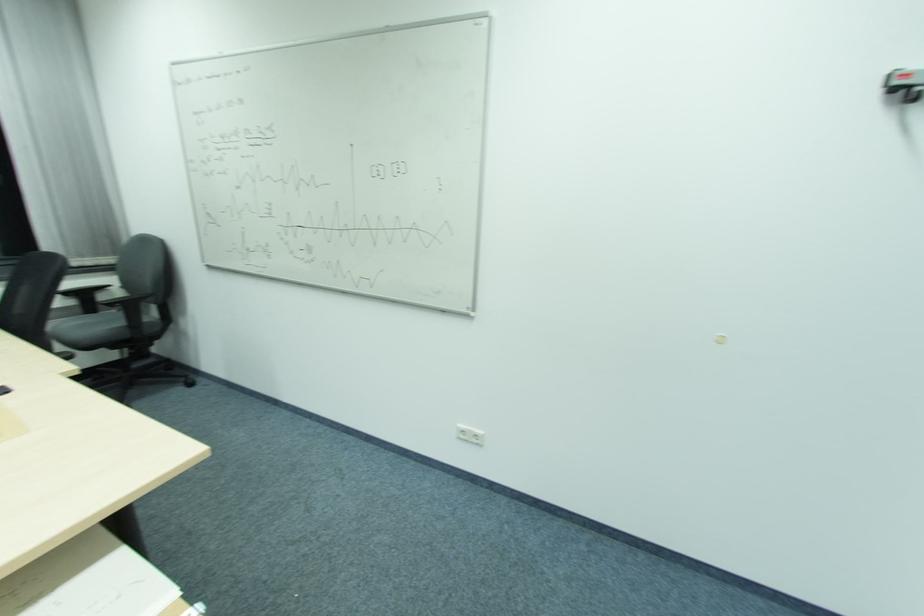
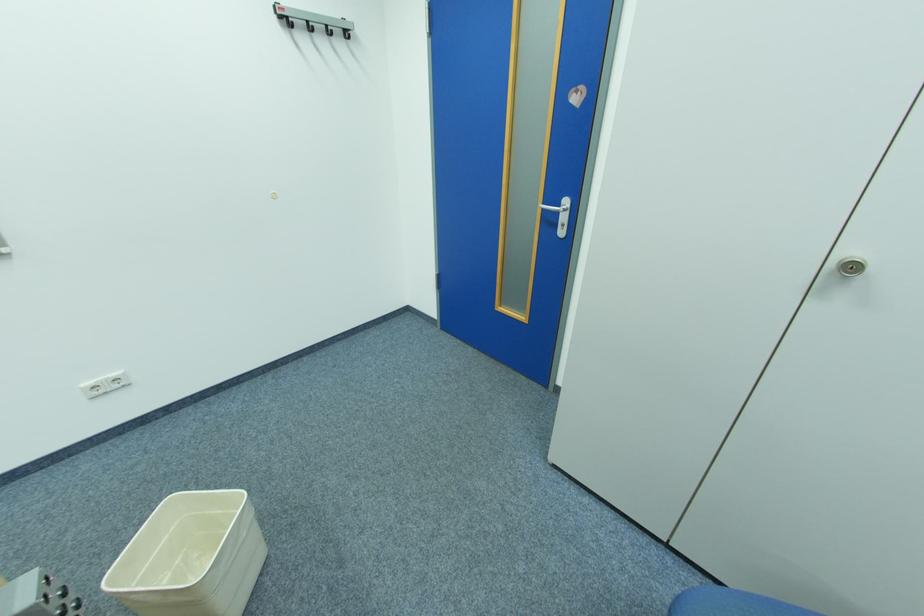
In the second image, find the point that corresponds to the point at 406,581 in the first image.

(143, 522)